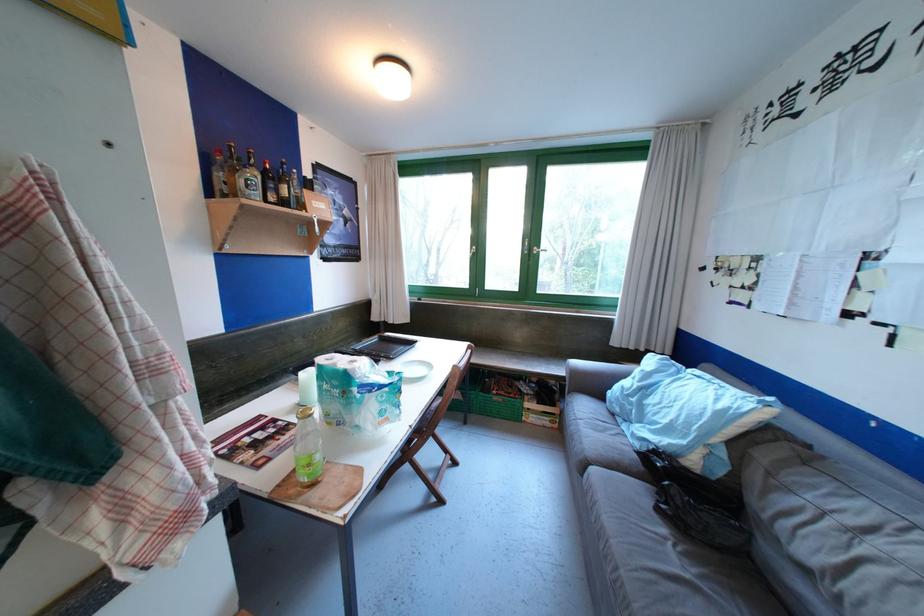
What do you see at coordinates (593, 377) in the screenshot? I see `the sofa armrest` at bounding box center [593, 377].